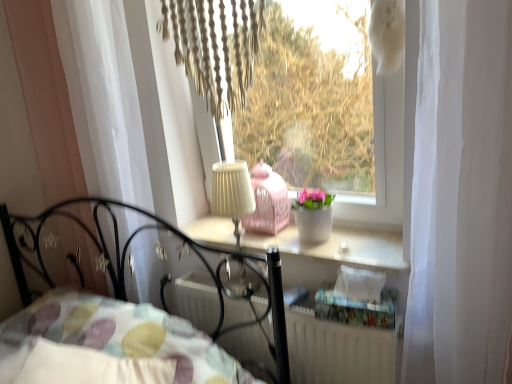
I want to click on free space above white matte window sill at center (from a real-world perspective), so click(x=293, y=240).